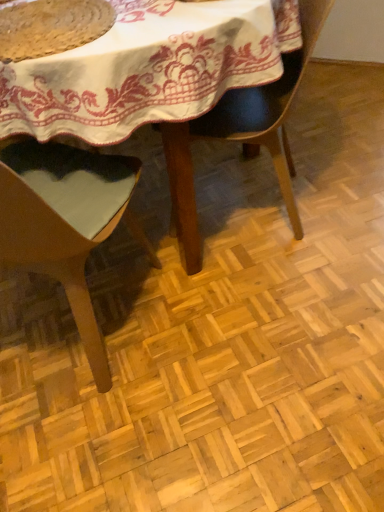
Question: From the image's perspective, would you say matte black chair at center, the 2th chair in the left-to-right sequence, is positioned over light brown wood chair at center, which ranks as the 1th chair in left-to-right order?

Choices:
 (A) yes
 (B) no

Answer: (A)

Question: Can you confirm if matte black chair at center, the 2th chair in the left-to-right sequence, is smaller than light brown wood chair at center, which ranks as the 1th chair in left-to-right order?

Choices:
 (A) yes
 (B) no

Answer: (A)

Question: Is light brown wood chair at center, which ranks as the 1th chair in left-to-right order, surrounded by matte black chair at center, placed as the first chair when sorted from right to left?

Choices:
 (A) no
 (B) yes

Answer: (A)

Question: Is matte black chair at center, the 2th chair in the left-to-right sequence, to the left of light brown wood chair at center, arranged as the second chair when viewed from the right, from the viewer's perspective?

Choices:
 (A) no
 (B) yes

Answer: (A)

Question: Is matte black chair at center, placed as the first chair when sorted from right to left, in contact with light brown wood chair at center, which ranks as the 1th chair in left-to-right order?

Choices:
 (A) no
 (B) yes

Answer: (A)

Question: Is matte black chair at center, the 2th chair in the left-to-right sequence, turned away from light brown wood chair at center, which ranks as the 1th chair in left-to-right order?

Choices:
 (A) yes
 (B) no

Answer: (B)

Question: Is matte black chair at center, placed as the first chair when sorted from right to left, to the left of rustic woven mat at upper left from the viewer's perspective?

Choices:
 (A) yes
 (B) no

Answer: (B)

Question: Can you confirm if matte black chair at center, placed as the first chair when sorted from right to left, is thinner than rustic woven mat at upper left?

Choices:
 (A) no
 (B) yes

Answer: (A)

Question: Considering the relative positions of matte black chair at center, the 2th chair in the left-to-right sequence, and rustic woven mat at upper left in the image provided, is matte black chair at center, the 2th chair in the left-to-right sequence, in front of rustic woven mat at upper left?

Choices:
 (A) no
 (B) yes

Answer: (A)

Question: From the image's perspective, is matte black chair at center, the 2th chair in the left-to-right sequence, beneath rustic woven mat at upper left?

Choices:
 (A) no
 (B) yes

Answer: (B)

Question: Does matte black chair at center, placed as the first chair when sorted from right to left, lie behind rustic woven mat at upper left?

Choices:
 (A) no
 (B) yes

Answer: (B)

Question: From the image's perspective, does matte black chair at center, the 2th chair in the left-to-right sequence, appear higher than rustic woven mat at upper left?

Choices:
 (A) no
 (B) yes

Answer: (A)

Question: Does light brown wood chair at center, arranged as the second chair when viewed from the right, have a smaller size compared to rustic woven mat at upper left?

Choices:
 (A) no
 (B) yes

Answer: (A)